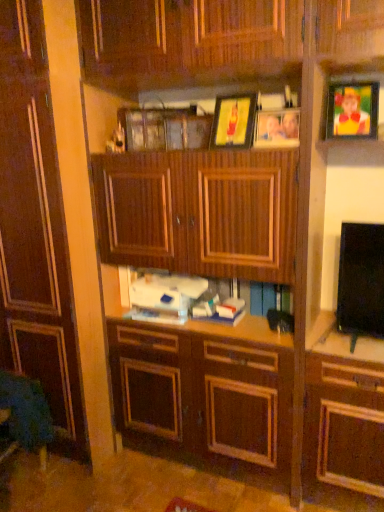
Locate an element on the screen. The height and width of the screenshot is (512, 384). wooden picture frame at upper center, arranged as the 2th picture frame when viewed from the left is located at coordinates (277, 128).

You are a GUI agent. You are given a task and a screenshot of the screen. Output one action in this format:
    pyautogui.click(x=<x>, y=<y>)
    Task: Click on the matte plastic picture frame at upper right, the third picture frame from the left
    The height and width of the screenshot is (512, 384).
    Given the screenshot: What is the action you would take?
    pyautogui.click(x=352, y=110)

Which is more to the right, wooden picture frame at upper center, acting as the 3th picture frame starting from the right, or wooden picture frame at upper center, arranged as the 2th picture frame when viewed from the left?

wooden picture frame at upper center, arranged as the 2th picture frame when viewed from the left.

Which of these two, wooden picture frame at upper center, acting as the 3th picture frame starting from the right, or wooden picture frame at upper center, arranged as the 2th picture frame when viewed from the left, is smaller?

With smaller size is wooden picture frame at upper center, arranged as the 2th picture frame when viewed from the left.

Can you tell me how much wooden picture frame at upper center, the first picture frame viewed from the left, and wooden picture frame at upper center, arranged as the 2th picture frame when viewed from the left, differ in facing direction?

10.1 degrees.

Can we say wooden picture frame at upper center, the first picture frame viewed from the left, lies outside wooden picture frame at upper center, which ranks as the second picture frame in right-to-left order?

Yes.

Can you tell me how much wooden picture frame at upper center, which ranks as the second picture frame in right-to-left order, and dark wood cabinet at center differ in facing direction?

The angle between the facing direction of wooden picture frame at upper center, which ranks as the second picture frame in right-to-left order, and the facing direction of dark wood cabinet at center is 4.58 degrees.

Looking at this image, measure the distance from wooden picture frame at upper center, which ranks as the second picture frame in right-to-left order, to dark wood cabinet at center.

wooden picture frame at upper center, which ranks as the second picture frame in right-to-left order, is 1.03 meters from dark wood cabinet at center.

Does wooden picture frame at upper center, which ranks as the second picture frame in right-to-left order, touch dark wood cabinet at center?

No, wooden picture frame at upper center, which ranks as the second picture frame in right-to-left order, is not next to dark wood cabinet at center.

Can you confirm if wooden picture frame at upper center, which ranks as the second picture frame in right-to-left order, is positioned to the right of dark wood cabinet at center?

Correct, you'll find wooden picture frame at upper center, which ranks as the second picture frame in right-to-left order, to the right of dark wood cabinet at center.

Consider the image. Considering the relative sizes of wooden picture frame at upper center, acting as the 3th picture frame starting from the right, and matte plastic picture frame at upper right, which is counted as the 1th picture frame, starting from the right, in the image provided, is wooden picture frame at upper center, acting as the 3th picture frame starting from the right, smaller than matte plastic picture frame at upper right, which is counted as the 1th picture frame, starting from the right,?

Correct, wooden picture frame at upper center, acting as the 3th picture frame starting from the right, occupies less space than matte plastic picture frame at upper right, which is counted as the 1th picture frame, starting from the right.

Is wooden picture frame at upper center, acting as the 3th picture frame starting from the right, to the right of matte plastic picture frame at upper right, the third picture frame from the left, from the viewer's perspective?

Incorrect, wooden picture frame at upper center, acting as the 3th picture frame starting from the right, is not on the right side of matte plastic picture frame at upper right, the third picture frame from the left.

From a real-world perspective, between wooden picture frame at upper center, the first picture frame viewed from the left, and matte plastic picture frame at upper right, which is counted as the 1th picture frame, starting from the right, who is vertically higher?

In real-world perspective, matte plastic picture frame at upper right, which is counted as the 1th picture frame, starting from the right, is above.

Is wooden picture frame at upper center, acting as the 3th picture frame starting from the right, oriented towards matte plastic picture frame at upper right, which is counted as the 1th picture frame, starting from the right?

No, wooden picture frame at upper center, acting as the 3th picture frame starting from the right, does not turn towards matte plastic picture frame at upper right, which is counted as the 1th picture frame, starting from the right.

The width and height of the screenshot is (384, 512). In order to click on cabinetry in front of the wooden picture frame at upper center, arranged as the 2th picture frame when viewed from the left in this screenshot , I will do `click(35, 227)`.

Who is shorter, dark wood cabinet at center or wooden picture frame at upper center, arranged as the 2th picture frame when viewed from the left?

wooden picture frame at upper center, arranged as the 2th picture frame when viewed from the left.

Between dark wood cabinet at center and wooden picture frame at upper center, which ranks as the second picture frame in right-to-left order, which one has larger size?

dark wood cabinet at center is bigger.

Considering the relative sizes of dark wood cabinet at center and wooden picture frame at upper center, which ranks as the second picture frame in right-to-left order, in the image provided, is dark wood cabinet at center thinner than wooden picture frame at upper center, which ranks as the second picture frame in right-to-left order,?

No.

Between matte plastic picture frame at upper right, which is counted as the 1th picture frame, starting from the right, and wooden picture frame at upper center, arranged as the 2th picture frame when viewed from the left, which one appears on the right side from the viewer's perspective?

Positioned to the right is matte plastic picture frame at upper right, which is counted as the 1th picture frame, starting from the right.

Considering the relative sizes of matte plastic picture frame at upper right, which is counted as the 1th picture frame, starting from the right, and wooden picture frame at upper center, arranged as the 2th picture frame when viewed from the left, in the image provided, is matte plastic picture frame at upper right, which is counted as the 1th picture frame, starting from the right, smaller than wooden picture frame at upper center, arranged as the 2th picture frame when viewed from the left,?

Actually, matte plastic picture frame at upper right, which is counted as the 1th picture frame, starting from the right, might be larger than wooden picture frame at upper center, arranged as the 2th picture frame when viewed from the left.

Consider the image. Considering the relative sizes of matte plastic picture frame at upper right, the third picture frame from the left, and wooden picture frame at upper center, which ranks as the second picture frame in right-to-left order, in the image provided, is matte plastic picture frame at upper right, the third picture frame from the left, taller than wooden picture frame at upper center, which ranks as the second picture frame in right-to-left order,?

Indeed, matte plastic picture frame at upper right, the third picture frame from the left, has a greater height compared to wooden picture frame at upper center, which ranks as the second picture frame in right-to-left order.

Which is closer to the camera, (339, 136) or (286, 109)?

Point (339, 136).

Can you confirm if dark wood cabinet at center is smaller than wooden picture frame at upper center, the first picture frame viewed from the left?

No.

From a real-world perspective, is dark wood cabinet at center located higher than wooden picture frame at upper center, acting as the 3th picture frame starting from the right?

No, from a real-world perspective, dark wood cabinet at center is not over wooden picture frame at upper center, acting as the 3th picture frame starting from the right

The image size is (384, 512). I want to click on the 2nd picture frame behind the dark wood cabinet at center, so click(x=234, y=121).

Between dark wood cabinet at center and wooden picture frame at upper center, acting as the 3th picture frame starting from the right, which one has less height?

With less height is wooden picture frame at upper center, acting as the 3th picture frame starting from the right.

Looking at their sizes, would you say wooden picture frame at upper center, arranged as the 2th picture frame when viewed from the left, is wider or thinner than wooden picture frame at upper center, acting as the 3th picture frame starting from the right?

wooden picture frame at upper center, arranged as the 2th picture frame when viewed from the left, is thinner than wooden picture frame at upper center, acting as the 3th picture frame starting from the right.

In the scene shown: Is wooden picture frame at upper center, which ranks as the second picture frame in right-to-left order, to the right of wooden picture frame at upper center, acting as the 3th picture frame starting from the right, from the viewer's perspective?

Yes.

Is the position of wooden picture frame at upper center, arranged as the 2th picture frame when viewed from the left, less distant than that of wooden picture frame at upper center, the first picture frame viewed from the left?

Yes, wooden picture frame at upper center, arranged as the 2th picture frame when viewed from the left, is closer to the camera.

You are a GUI agent. You are given a task and a screenshot of the screen. Output one action in this format:
    pyautogui.click(x=<x>, y=<y>)
    Task: Click on the 2nd picture frame above the wooden picture frame at upper center, arranged as the 2th picture frame when viewed from the left (from the image's perspective)
    
    Given the screenshot: What is the action you would take?
    pyautogui.click(x=234, y=121)

Where is `picture frame that is the 1st one above the dark wood cabinet at center (from a real-world perspective)`? This screenshot has width=384, height=512. picture frame that is the 1st one above the dark wood cabinet at center (from a real-world perspective) is located at coordinates (277, 128).

When comparing their distances from dark wood cabinet at center, does wooden picture frame at upper center, which ranks as the second picture frame in right-to-left order, or wooden picture frame at upper center, acting as the 3th picture frame starting from the right, seem closer?

Among the two, wooden picture frame at upper center, acting as the 3th picture frame starting from the right, is located nearer to dark wood cabinet at center.

Looking at the image, which one is located further to dark wood cabinet at center, wooden picture frame at upper center, the first picture frame viewed from the left, or wooden picture frame at upper center, which ranks as the second picture frame in right-to-left order?

Based on the image, wooden picture frame at upper center, which ranks as the second picture frame in right-to-left order, appears to be further to dark wood cabinet at center.

Considering their positions, is matte plastic picture frame at upper right, which is counted as the 1th picture frame, starting from the right, positioned closer to dark wood cabinet at center than wooden picture frame at upper center, the first picture frame viewed from the left?

wooden picture frame at upper center, the first picture frame viewed from the left, lies closer to dark wood cabinet at center than the other object.

Consider the image. Considering their positions, is matte plastic picture frame at upper right, the third picture frame from the left, positioned further to wooden picture frame at upper center, which ranks as the second picture frame in right-to-left order, than dark wood cabinet at center?

dark wood cabinet at center lies further to wooden picture frame at upper center, which ranks as the second picture frame in right-to-left order, than the other object.

Looking at the image, which one is located closer to dark wood cabinet at center, matte plastic picture frame at upper right, the third picture frame from the left, or wooden picture frame at upper center, arranged as the 2th picture frame when viewed from the left?

wooden picture frame at upper center, arranged as the 2th picture frame when viewed from the left, lies closer to dark wood cabinet at center than the other object.

Based on their spatial positions, is dark wood cabinet at center or wooden picture frame at upper center, arranged as the 2th picture frame when viewed from the left, further from matte plastic picture frame at upper right, the third picture frame from the left?

dark wood cabinet at center lies further to matte plastic picture frame at upper right, the third picture frame from the left, than the other object.

When comparing their distances from wooden picture frame at upper center, acting as the 3th picture frame starting from the right, does wooden picture frame at upper center, which ranks as the second picture frame in right-to-left order, or dark wood cabinet at center seem closer?

wooden picture frame at upper center, which ranks as the second picture frame in right-to-left order.

Looking at the image, which one is located closer to wooden picture frame at upper center, arranged as the 2th picture frame when viewed from the left, dark wood cabinet at center or matte plastic picture frame at upper right, which is counted as the 1th picture frame, starting from the right?

Among the two, matte plastic picture frame at upper right, which is counted as the 1th picture frame, starting from the right, is located nearer to wooden picture frame at upper center, arranged as the 2th picture frame when viewed from the left.

Image resolution: width=384 pixels, height=512 pixels. I want to click on picture frame between dark wood cabinet at center and wooden picture frame at upper center, which ranks as the second picture frame in right-to-left order, so click(234, 121).

At what (x,y) coordinates should I click in order to perform the action: click on picture frame between wooden picture frame at upper center, the first picture frame viewed from the left, and matte plastic picture frame at upper right, the third picture frame from the left, in the horizontal direction. Please return your answer as a coordinate pair (x, y). The height and width of the screenshot is (512, 384). Looking at the image, I should click on (277, 128).